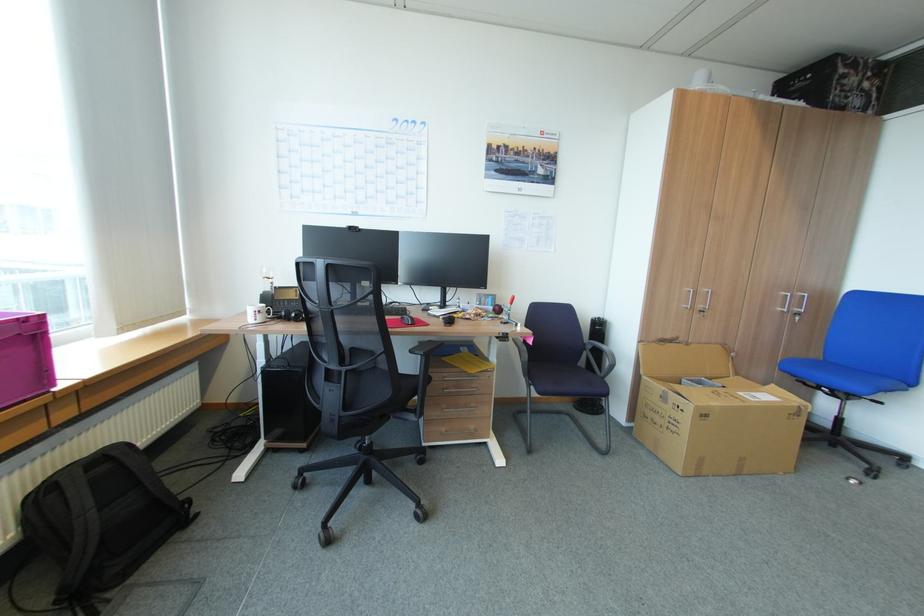
Identify the location of pink plastic crate. (25, 357).